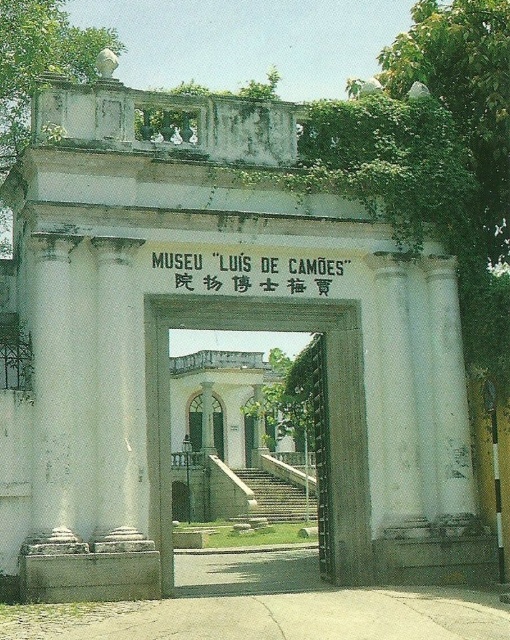
Question: Which point is farther to the camera?

Choices:
 (A) (301, 291)
 (B) (156, 362)

Answer: (A)

Question: Among these points, which one is nearest to the camera?

Choices:
 (A) (206, 280)
 (B) (342, 472)

Answer: (A)

Question: Among these objects, which one is nearest to the camera?

Choices:
 (A) white paper sign at center
 (B) stone gate at center

Answer: (B)

Question: Is stone gate at center below white paper sign at center?

Choices:
 (A) yes
 (B) no

Answer: (A)

Question: Does stone gate at center appear under white paper sign at center?

Choices:
 (A) yes
 (B) no

Answer: (A)

Question: Does stone gate at center have a smaller size compared to white paper sign at center?

Choices:
 (A) no
 (B) yes

Answer: (A)